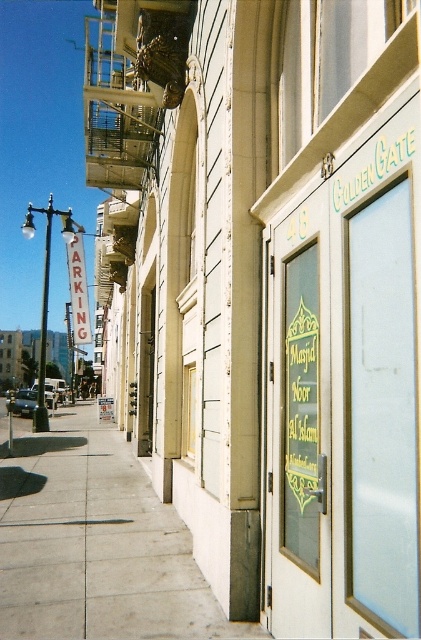
You are a delivery person approaching the Golden Gate building and need to enter the Masjid Noor Al Islam. The entrance has a translucent glass door at center and a white plastic parking sign at left. Which object is located above the other?

The white plastic parking sign at left is above the translucent glass door at center because the translucent glass door at center is positioned under it.

In the scene shown: You are a delivery person trying to reach the entrance of the mosque. You see the concrete sidewalk at lower left and the transparent glass door at center. Which object is closer to you as you approach from the street?

The concrete sidewalk at lower left is closer to you because the transparent glass door at center is behind it, meaning the sidewalk is in front.